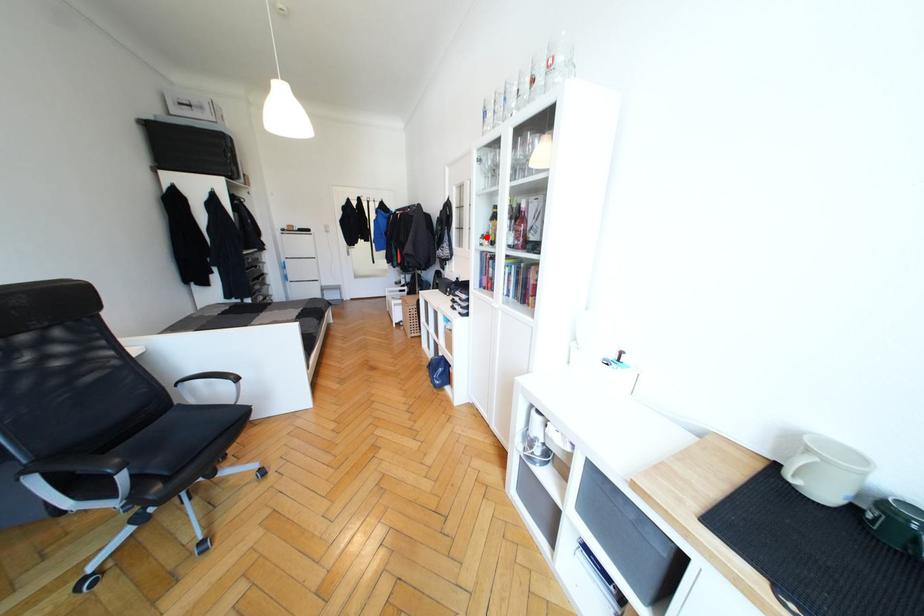
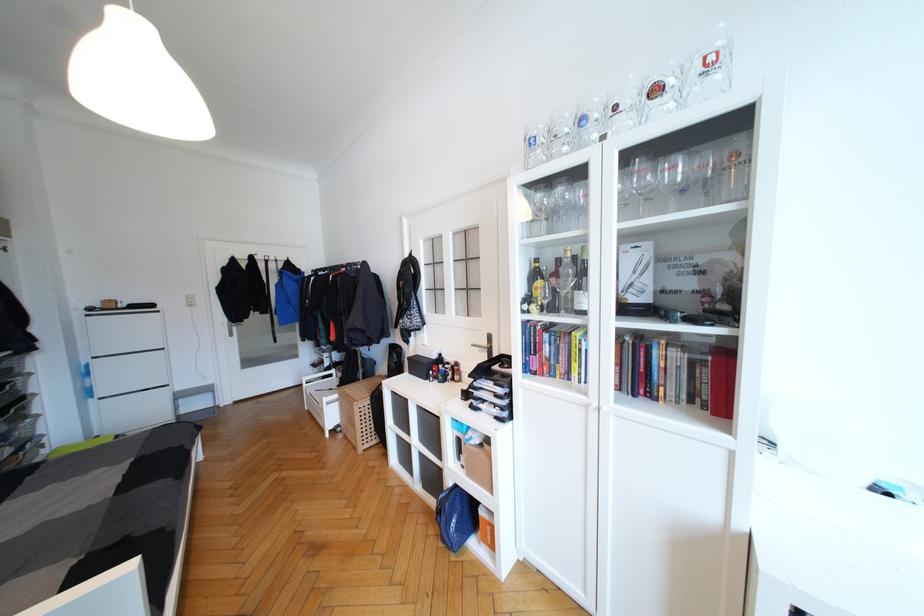
Where in the second image is the point corresponding to the highlighted location from the first image?

(531, 301)